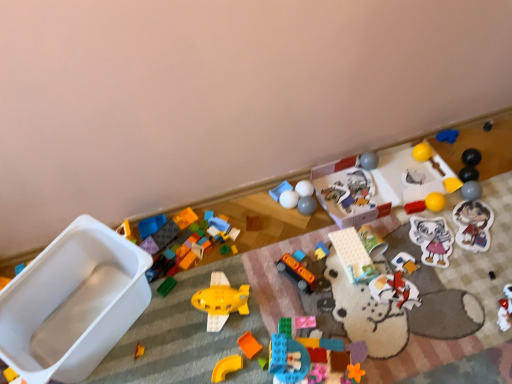
Find the location of `free space in front of white matte balls at center, the 17th toy viewed from the right`. free space in front of white matte balls at center, the 17th toy viewed from the right is located at coordinates (294, 239).